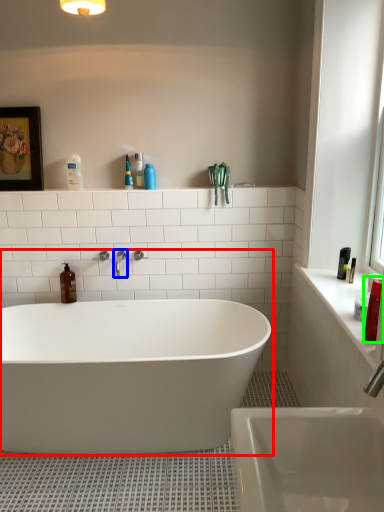
Question: Based on their relative distances, which object is farther from bathtub (highlighted by a red box)? Choose from tap (highlighted by a blue box) and cleaning product (highlighted by a green box).

Choices:
 (A) tap
 (B) cleaning product

Answer: (B)